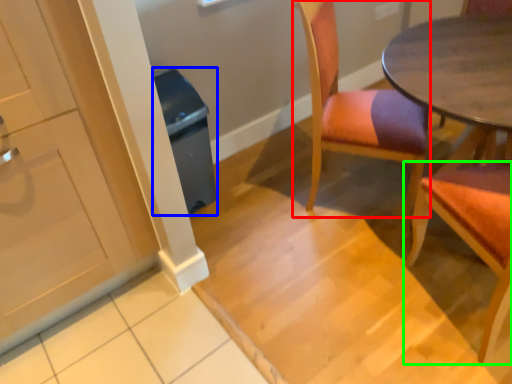
Question: Based on their relative distances, which object is farther from chair (highlighted by a red box)? Choose from trash bin/can (highlighted by a blue box) and chair (highlighted by a green box).

Choices:
 (A) trash bin/can
 (B) chair

Answer: (A)